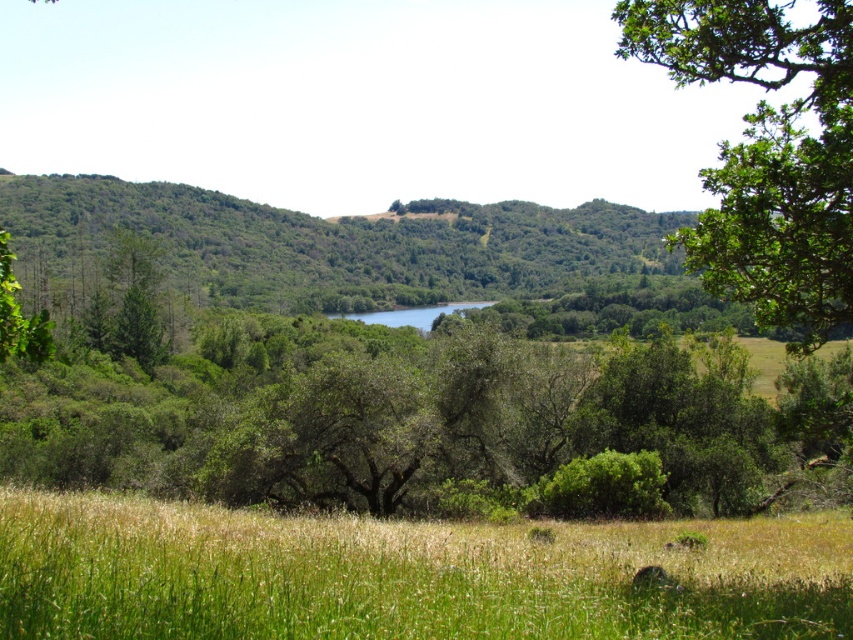
Question: Which object appears closest to the camera in this image?

Choices:
 (A) green leafy tree at center
 (B) green leafy tree at upper right
 (C) green grassy field at lower center

Answer: (C)

Question: Does green grassy field at lower center appear on the left side of green leafy tree at upper right?

Choices:
 (A) yes
 (B) no

Answer: (A)

Question: Does green grassy field at lower center have a greater width compared to green leafy tree at upper right?

Choices:
 (A) yes
 (B) no

Answer: (B)

Question: Can you confirm if green leafy tree at center is positioned to the left of green grassy field at lower center?

Choices:
 (A) no
 (B) yes

Answer: (B)

Question: Estimate the real-world distances between objects in this image. Which object is farther from the green leafy tree at upper right?

Choices:
 (A) green grassy field at lower center
 (B) green leafy tree at center

Answer: (B)

Question: Which point is farther to the camera?

Choices:
 (A) green leafy tree at center
 (B) green leafy tree at upper right

Answer: (B)